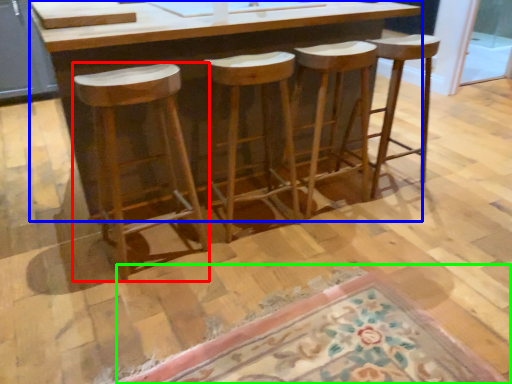
Question: Based on their relative distances, which object is nearer to stool (highlighted by a red box)? Choose from counter (highlighted by a blue box) and doormat (highlighted by a green box).

Choices:
 (A) counter
 (B) doormat

Answer: (A)